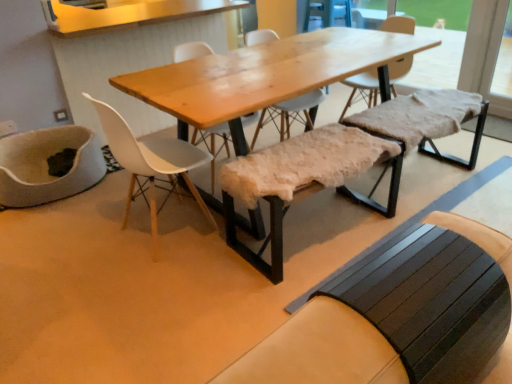
Question: From a real-world perspective, is dark brown wooden bench at lower right, positioned as the third church bench in back-to-front order, positioned above or below fuzzy sheepskin bench at center, the second church bench from the front?

Choices:
 (A) below
 (B) above

Answer: (B)

Question: Would you say dark brown wooden bench at lower right, positioned as the third church bench in back-to-front order, is to the left or to the right of fuzzy sheepskin bench at center, the second church bench from the front, in the picture?

Choices:
 (A) right
 (B) left

Answer: (A)

Question: Estimate the real-world distances between objects in this image. Which object is farther from the wooden armchair at upper center?

Choices:
 (A) fuzzy sheepskin bench at center, marked as the second church bench in a back-to-front arrangement
 (B) natural wood table at center
 (C) matte white chair at center
 (D) dark brown wooden bench at lower right, the 1th church bench when ordered from front to back
 (E) fuzzy sheepskin bench at center, which is the 3th church bench from front to back

Answer: (D)

Question: Based on their relative distances, which object is farther from the matte white chair at center?

Choices:
 (A) wooden armchair at upper center
 (B) natural wood table at center
 (C) fuzzy sheepskin bench at center, which is the 3th church bench from front to back
 (D) dark brown wooden bench at lower right, positioned as the third church bench in back-to-front order
 (E) fuzzy sheepskin bench at center, marked as the second church bench in a back-to-front arrangement

Answer: (A)